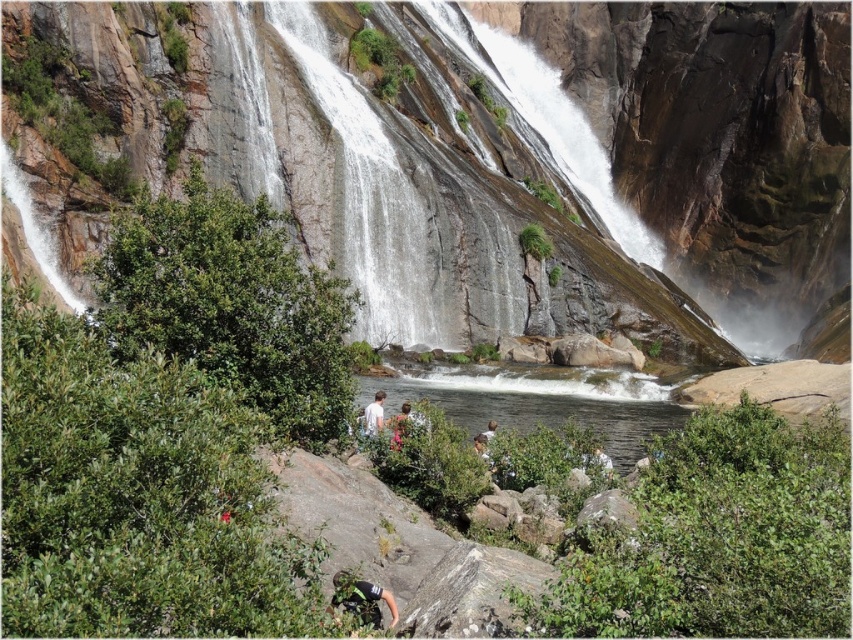
Question: Can you confirm if white matte shirt at center is wider than green fabric shirt at center?

Choices:
 (A) yes
 (B) no

Answer: (B)

Question: Among these objects, which one is nearest to the camera?

Choices:
 (A) clear water at center
 (B) green fabric shirt at center
 (C) green climbing harness at lower center
 (D) white matte shirt at center

Answer: (C)

Question: Among these points, which one is nearest to the camera?

Choices:
 (A) (407, 419)
 (B) (589, 502)
 (C) (373, 422)

Answer: (B)

Question: Can you confirm if gray rough rock at center is positioned to the left of green fabric shirt at center?

Choices:
 (A) yes
 (B) no

Answer: (B)

Question: Estimate the real-world distances between objects in this image. Which object is closer to the clear water at center?

Choices:
 (A) green climbing harness at lower center
 (B) gray rough rock at center
 (C) white matte shirt at center
 (D) green fabric shirt at center

Answer: (D)

Question: Is white matte shirt at center below green fabric shirt at center?

Choices:
 (A) yes
 (B) no

Answer: (B)